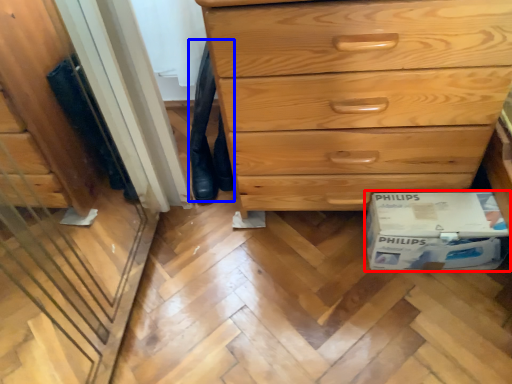
Question: Which point is further to the camera, cardboard box (highlighted by a red box) or jeans (highlighted by a blue box)?

Choices:
 (A) cardboard box
 (B) jeans

Answer: (B)